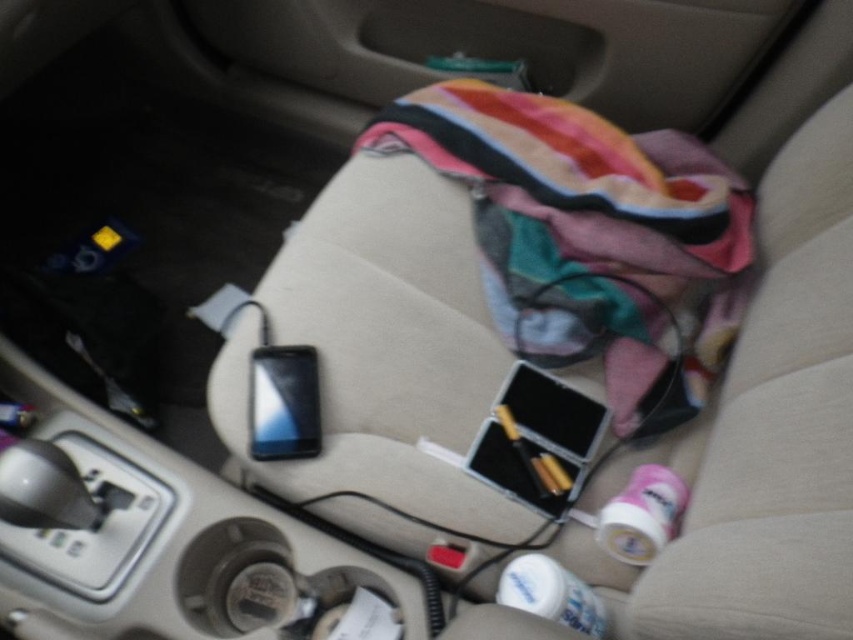
Can you confirm if striped cotton blanket at center is thinner than satin black phone at center?

In fact, striped cotton blanket at center might be wider than satin black phone at center.

Consider the image. Can you confirm if striped cotton blanket at center is positioned to the left of satin black phone at center?

No, striped cotton blanket at center is not to the left of satin black phone at center.

Who is more distant from viewer, (450,144) or (285,449)?

The point (450,144) is more distant.

Image resolution: width=853 pixels, height=640 pixels. Find the location of `striped cotton blanket at center`. striped cotton blanket at center is located at coordinates (590, 237).